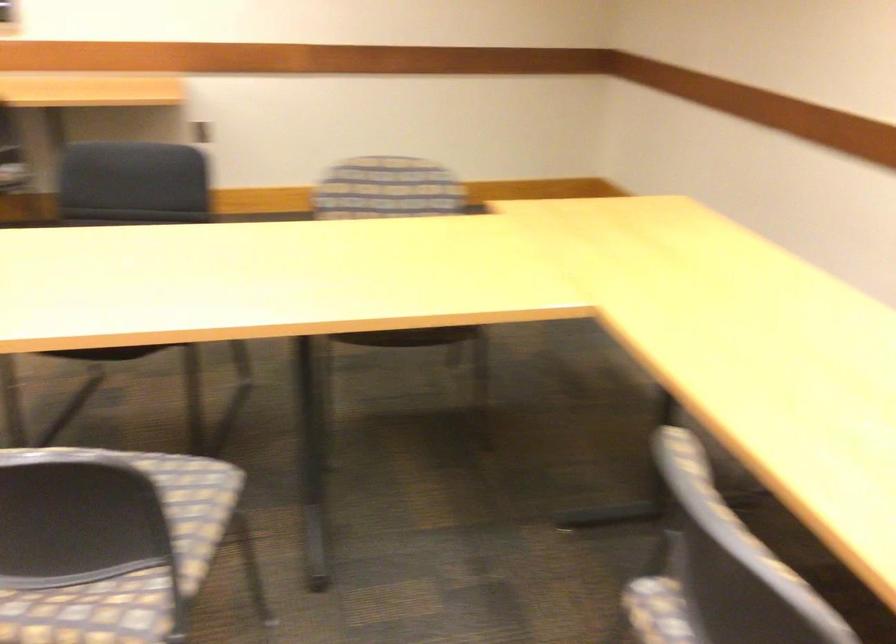
Image resolution: width=896 pixels, height=644 pixels. Describe the element at coordinates (126, 558) in the screenshot. I see `the striped chair sitting surface` at that location.